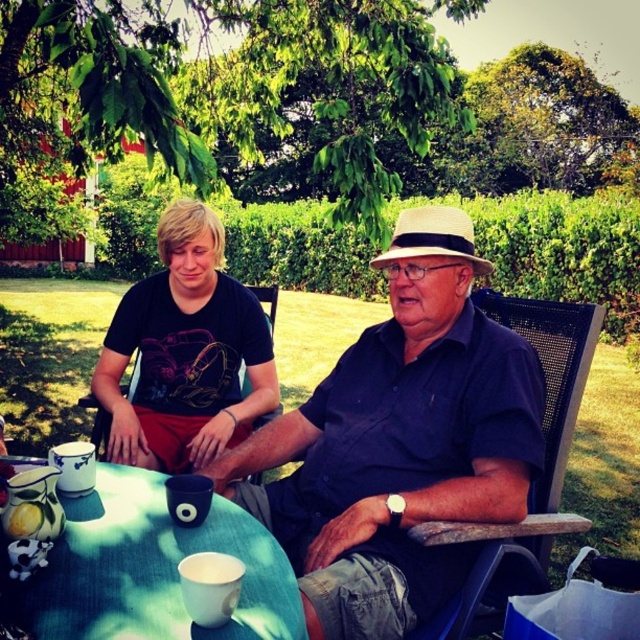
Question: Which point appears closest to the camera in this image?

Choices:
 (A) (124, 390)
 (B) (323, 612)

Answer: (B)

Question: Can you confirm if black mesh chair at center is thinner than black plastic chair at left?

Choices:
 (A) no
 (B) yes

Answer: (A)

Question: Which point is closer to the camera taking this photo?

Choices:
 (A) (150, 628)
 (B) (104, 436)
 (C) (477, 586)
 (D) (323, 387)

Answer: (A)

Question: Is matte blue shirt at center to the right of black plastic chair at left from the viewer's perspective?

Choices:
 (A) yes
 (B) no

Answer: (A)

Question: Which point is farther to the camera?

Choices:
 (A) tap(138, 369)
 (B) tap(560, 525)
 (C) tap(266, 497)
 (D) tap(122, 484)

Answer: (A)

Question: Can you confirm if matte blue shirt at center is smaller than black mesh chair at center?

Choices:
 (A) yes
 (B) no

Answer: (B)